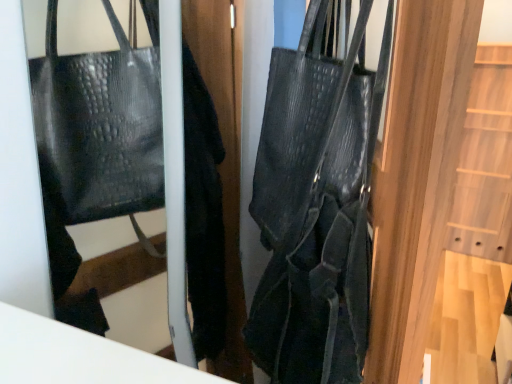
Question: From a real-world perspective, is black leather coat at center beneath black textured handbag at center?

Choices:
 (A) no
 (B) yes

Answer: (B)

Question: Can you confirm if black leather coat at center is bigger than black textured handbag at center?

Choices:
 (A) yes
 (B) no

Answer: (B)

Question: Is black leather coat at center at the left side of black textured handbag at center?

Choices:
 (A) no
 (B) yes

Answer: (B)

Question: Can you confirm if black leather coat at center is wider than black textured handbag at center?

Choices:
 (A) yes
 (B) no

Answer: (B)

Question: Does black leather coat at center have a smaller size compared to black textured handbag at center?

Choices:
 (A) yes
 (B) no

Answer: (A)

Question: Is black leather coat at center positioned with its back to black textured handbag at center?

Choices:
 (A) no
 (B) yes

Answer: (A)

Question: Is black textured handbag at center closer to camera compared to black leather coat at center?

Choices:
 (A) yes
 (B) no

Answer: (A)

Question: Considering the relative sizes of black textured handbag at center and black leather coat at center in the image provided, is black textured handbag at center taller than black leather coat at center?

Choices:
 (A) no
 (B) yes

Answer: (A)

Question: Does black textured handbag at center have a lesser width compared to black leather coat at center?

Choices:
 (A) no
 (B) yes

Answer: (A)

Question: Is there a large distance between black textured handbag at center and black leather coat at center?

Choices:
 (A) yes
 (B) no

Answer: (B)

Question: From the image's perspective, is black textured handbag at center on black leather coat at center?

Choices:
 (A) yes
 (B) no

Answer: (B)

Question: Considering the relative sizes of black textured handbag at center and black leather coat at center in the image provided, is black textured handbag at center wider than black leather coat at center?

Choices:
 (A) yes
 (B) no

Answer: (A)

Question: From the image's perspective, is black leather coat at center located above or below black textured handbag at center?

Choices:
 (A) below
 (B) above

Answer: (B)